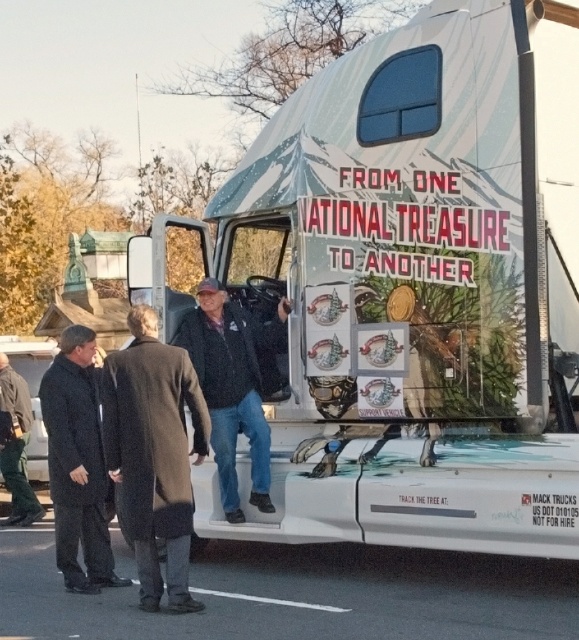
Consider the image. Between white matte truck at center and black matte coat at lower left, which one appears on the left side from the viewer's perspective?

black matte coat at lower left

Between point (560, 449) and point (65, 348), which one is positioned behind?

The point (65, 348) is more distant.

Between point (299, 541) and point (126, 580), which one is positioned behind?

Point (126, 580)

Locate an element on the screen. white matte truck at center is located at coordinates (397, 296).

Can you confirm if dark gray wool coat at center is positioned below dark brown leather jacket at lower left?

Actually, dark gray wool coat at center is above dark brown leather jacket at lower left.

Which is below, dark gray wool coat at center or dark brown leather jacket at lower left?

dark brown leather jacket at lower left is below.

The height and width of the screenshot is (640, 579). What do you see at coordinates (153, 452) in the screenshot?
I see `dark gray wool coat at center` at bounding box center [153, 452].

In order to click on dark gray wool coat at center in this screenshot , I will do `click(153, 452)`.

Is point (353, 515) farther from viewer compared to point (174, 362)?

Yes, point (353, 515) is farther from viewer.

Can you confirm if white matte truck at center is positioned to the right of dark gray wool coat at center?

Yes, white matte truck at center is to the right of dark gray wool coat at center.

The width and height of the screenshot is (579, 640). What are the coordinates of `white matte truck at center` in the screenshot? It's located at (397, 296).

You are a GUI agent. You are given a task and a screenshot of the screen. Output one action in this format:
    pyautogui.click(x=<x>, y=<y>)
    Task: Click on the white matte truck at center
    The image size is (579, 640).
    Given the screenshot: What is the action you would take?
    pyautogui.click(x=397, y=296)